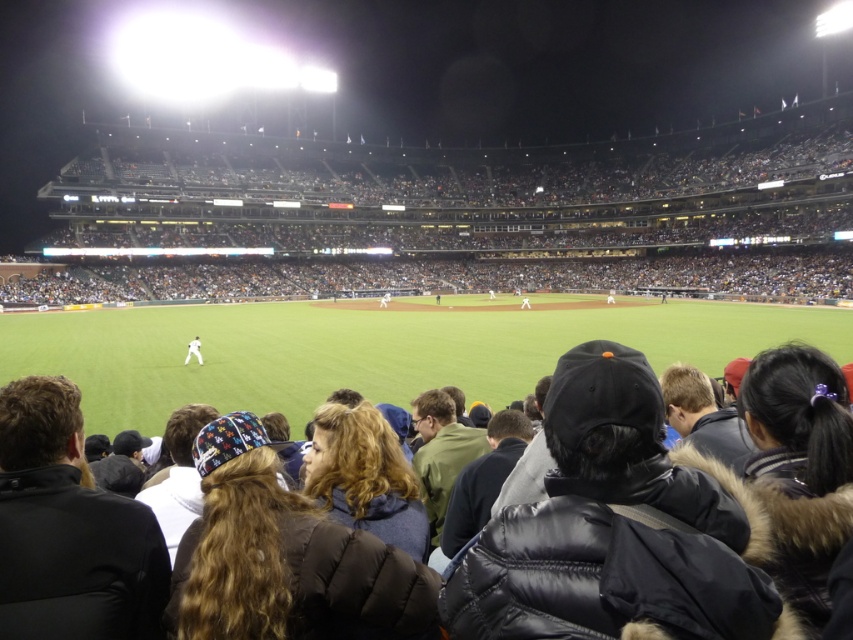
You are trying to locate a person wearing a black puffy coat at center in a crowded baseball stadium. If you are standing at the origin point, which is the bottom left corner of the image, can you determine their approximate location using coordinates?

The black puffy coat at center is located at coordinates approximately 0.8 on the x and y axes, meaning it is positioned towards the upper right portion of the image.

You are a spectator sitting in the stands and want to take a photo of the white matte baseball player at center without the black puffy coat at center blocking your view. Is this possible?

The black puffy coat at center is closer to the viewer than the white matte baseball player at center, so the black puffy coat at center would block the view of the white matte baseball player at center. Therefore, it is not possible to take a clear photo of the white matte baseball player at center without obstruction.

You are a photographer standing at the center of the baseball field. You want to take a photo that includes both the point at coordinates point (537,628) and point (192,342). Which point should you focus on first to ensure both are in focus?

You should focus on point (537,628) first because it is closer to the camera than point (192,342), ensuring both points will be in focus when using a proper depth of field.